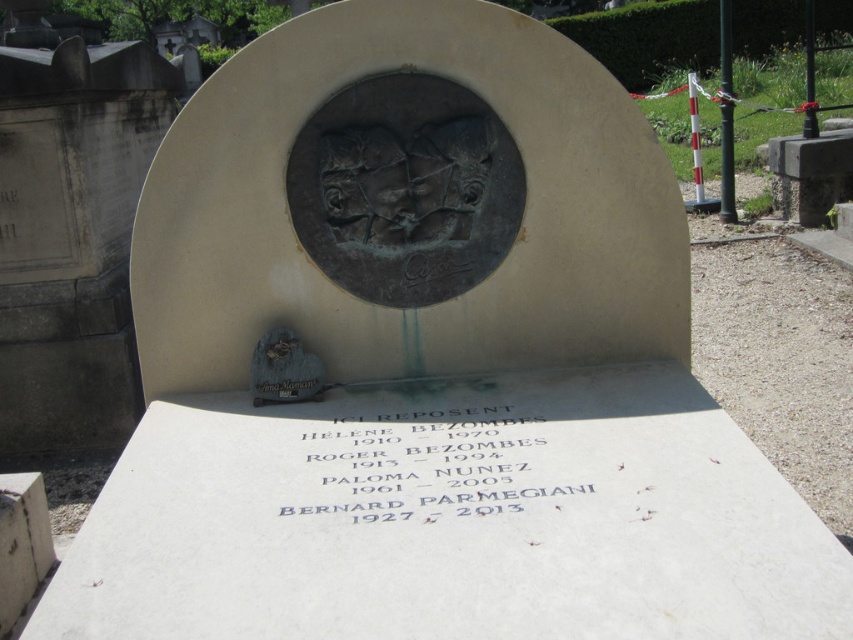
You are a historian examining the tombstone and notice the bronze plaque at center and the shiny bronze heart at center. Which object is positioned in front of the other?

The bronze plaque at center is closer to the viewer than the shiny bronze heart at center, so the bronze plaque at center is positioned in front of the shiny bronze heart at center.

What is the spatial relationship between the bronze plaque at center and the shiny bronze heart at center on the tombstone?

The bronze plaque at center is above the shiny bronze heart at center.